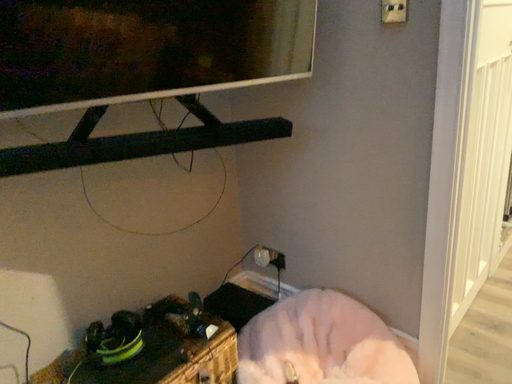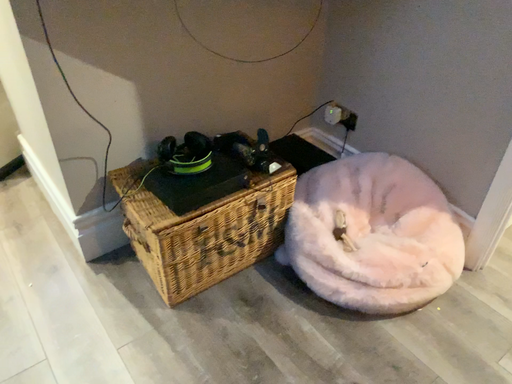
Question: How did the camera likely rotate when shooting the video?

Choices:
 (A) rotated right
 (B) rotated left

Answer: (B)